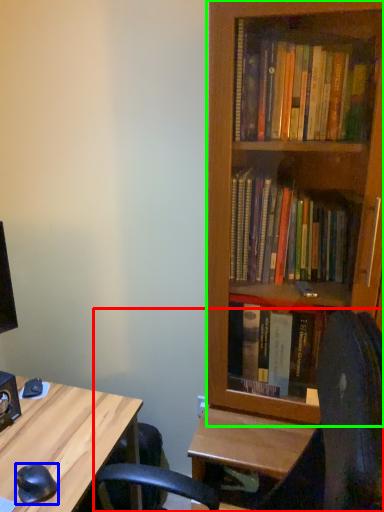
Question: Which is nearer to the computer chair (highlighted by a red box)? mouse (highlighted by a blue box) or bookcase (highlighted by a green box).

Choices:
 (A) mouse
 (B) bookcase

Answer: (B)